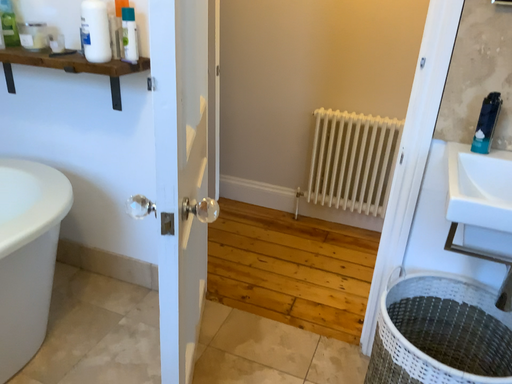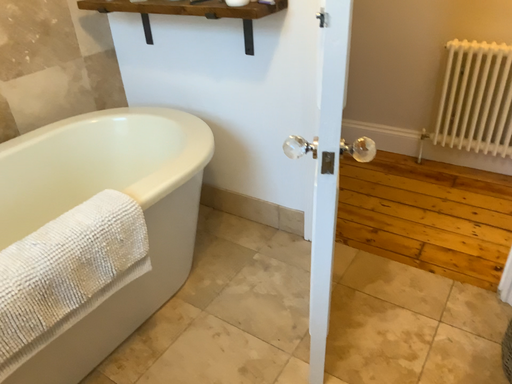
Question: Which way did the camera rotate in the video?

Choices:
 (A) rotated left
 (B) rotated right

Answer: (A)